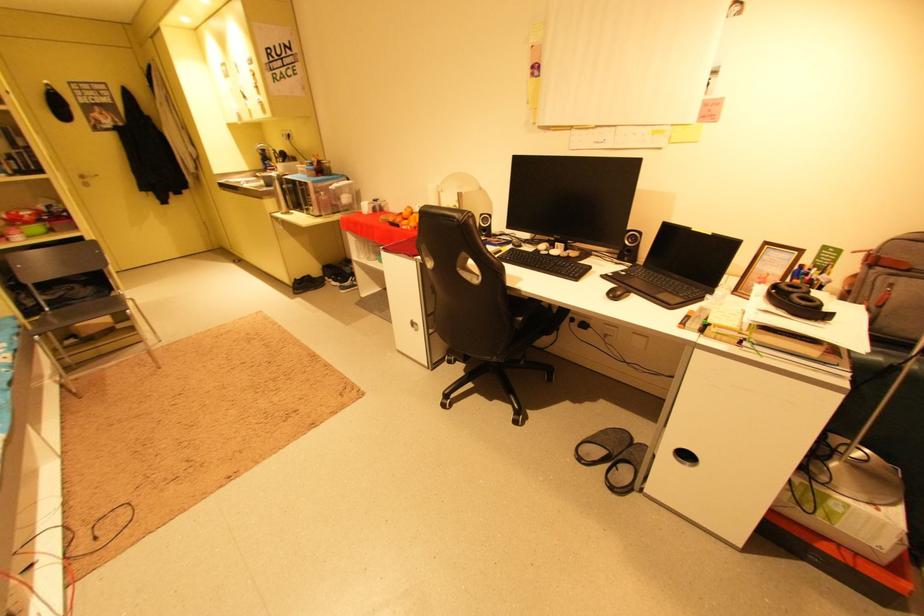
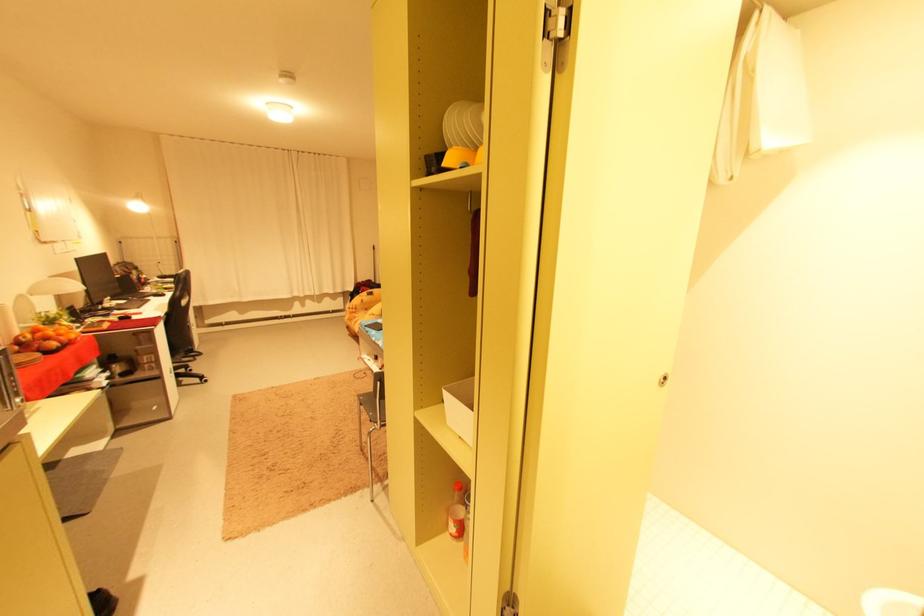
Where in the second image is the point corresponding to the point at 419,328 from the first image?

(179, 376)